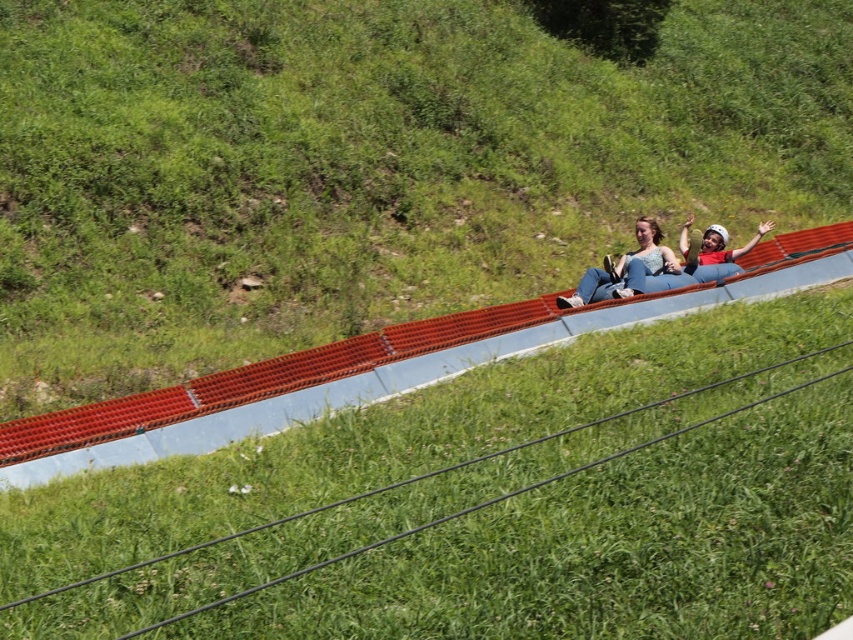
You are a photographer planning to take a picture of the red plastic rail at center and the matte blue tube at center. To ensure both are in focus, you need to know their vertical arrangement. Which object is positioned lower in the frame?

The red plastic rail at center is positioned below the matte blue tube at center, so it is lower in the frame.

You are a photographer trying to capture a clear photo of the matte blue tube at center and the matte blue helmet at center. Which object should you focus on first to ensure both are in focus?

The matte blue tube at center is in front of the matte blue helmet at center, so you should focus on the matte blue tube at center first to ensure both are in focus.